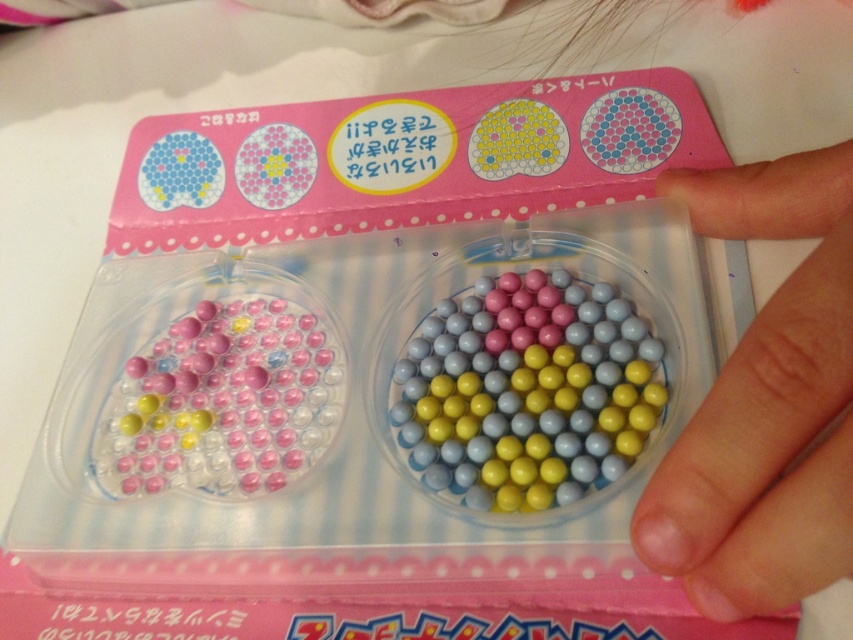
You are a child trying to decide whether to place a sticker on the smooth skin at lower right or the matte plastic beads at center. Since the sticker is 5 cm wide, which object can it fit on without overlapping?

The matte plastic beads at center can fit the 5 cm wide sticker because its width is greater than the smooth skin at lower right.

In the scene shown: You are a child trying to reach the glossy plastic beads at center from where you are holding the smooth skin at lower right. Can you reach them without moving your hand? The kit is designed for children and has a maximum recommended reach distance of 4 inches.

The smooth skin at lower right and glossy plastic beads at center are 4.51 inches apart, which exceeds the recommended 4 inches. Therefore, you cannot reach the glossy plastic beads at center without moving your hand.

You are a child trying to choose between the glossy plastic beads at center and the matte plastic beads at center for your bead art project. Which set of beads is wider?

The matte plastic beads at center has a greater width compared to the glossy plastic beads at center, so the matte plastic beads at center is wider.